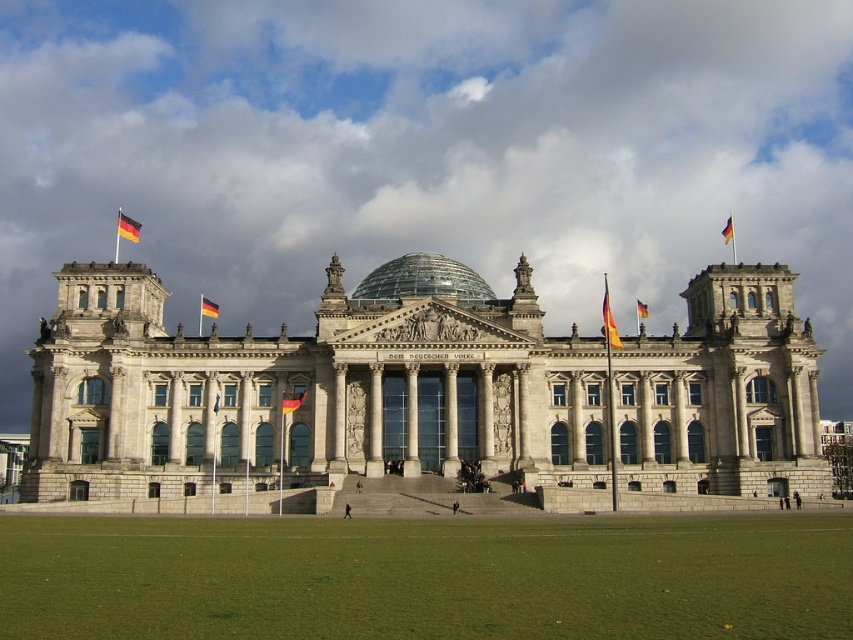
You are a tourist visiting the Reichstag building. You want to take a photo that includes both the white stone building at center and the green grass at lower center. Which object should you focus on first to ensure both are in frame?

You should focus on the white stone building at center first since it is much taller than the green grass at lower center, so adjusting the camera angle to include its height will naturally include the lower grass in the foreground.

You are a tourist standing in front of the Reichstag building. You notice the green grass at lower center and the yellow and red striped fabric at upper center. Which of these two objects appears wider in the image?

The green grass at lower center appears wider than the yellow and red striped fabric at upper center because its width is larger according to the description.

Consider the image. You are standing in front of the Reichstag building and want to take a photo of the green grass at lower center. According to the coordinates provided, where should you position your camera to capture the grass in the frame?

The green grass at lower center is located at coordinates point (427, 577), so position your camera to focus on that point to capture it in the frame.